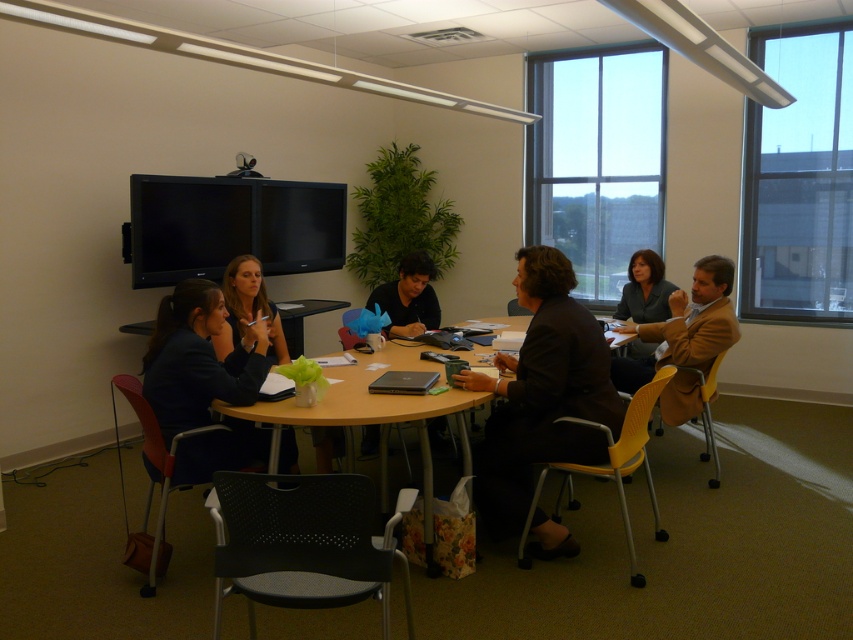
Question: Among these objects, which one is farthest from the camera?

Choices:
 (A) wooden round table at center
 (B) matte black blazer at lower left

Answer: (B)

Question: Which object is closer to the camera taking this photo?

Choices:
 (A) wooden round table at center
 (B) matte black blazer at lower left

Answer: (A)

Question: Does matte black blazer at lower left have a greater width compared to wooden round table at center?

Choices:
 (A) yes
 (B) no

Answer: (B)

Question: Is matte black blazer at lower left to the left of wooden round table at center from the viewer's perspective?

Choices:
 (A) yes
 (B) no

Answer: (A)

Question: Does matte black blazer at lower left lie in front of wooden round table at center?

Choices:
 (A) yes
 (B) no

Answer: (B)